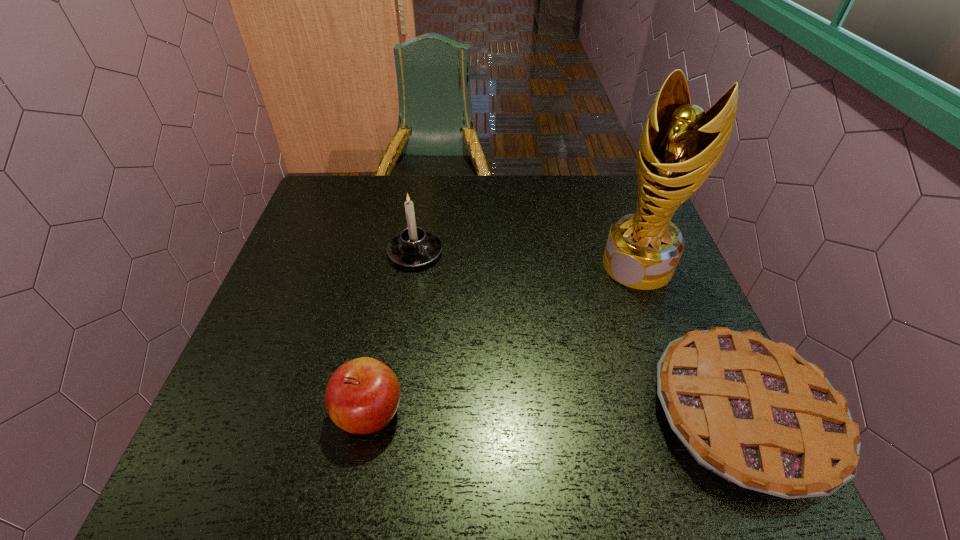
What are the coordinates of `vacant space positioned 0.210m with a handle on the side of the candle holder` in the screenshot? It's located at (485, 314).

Locate an element on the screen. This screenshot has height=540, width=960. free space located with a handle on the side of the candle holder is located at coordinates (455, 288).

The height and width of the screenshot is (540, 960). In order to click on apple located at the near edge in this screenshot , I will do `click(362, 396)`.

You are a GUI agent. You are given a task and a screenshot of the screen. Output one action in this format:
    pyautogui.click(x=<x>, y=<y>)
    Task: Click on the pie that is at the near edge
    
    Given the screenshot: What is the action you would take?
    pyautogui.click(x=754, y=412)

Identify the location of pie that is positioned at the right edge. This screenshot has width=960, height=540. (754, 412).

This screenshot has height=540, width=960. In order to click on award that is at the right edge in this screenshot , I will do `click(680, 144)`.

You are a GUI agent. You are given a task and a screenshot of the screen. Output one action in this format:
    pyautogui.click(x=<x>, y=<y>)
    Task: Click on the object that is positioned at the near right corner
    
    Given the screenshot: What is the action you would take?
    [x=754, y=412]

In order to click on vacant space at the far edge of the desktop in this screenshot , I will do `click(389, 218)`.

Where is `free space at the near edge`? The height and width of the screenshot is (540, 960). free space at the near edge is located at coordinates (620, 388).

You are a GUI agent. You are given a task and a screenshot of the screen. Output one action in this format:
    pyautogui.click(x=<x>, y=<y>)
    Task: Click on the vacant space at the left edge of the desktop
    This screenshot has width=960, height=540.
    Given the screenshot: What is the action you would take?
    coord(304,383)